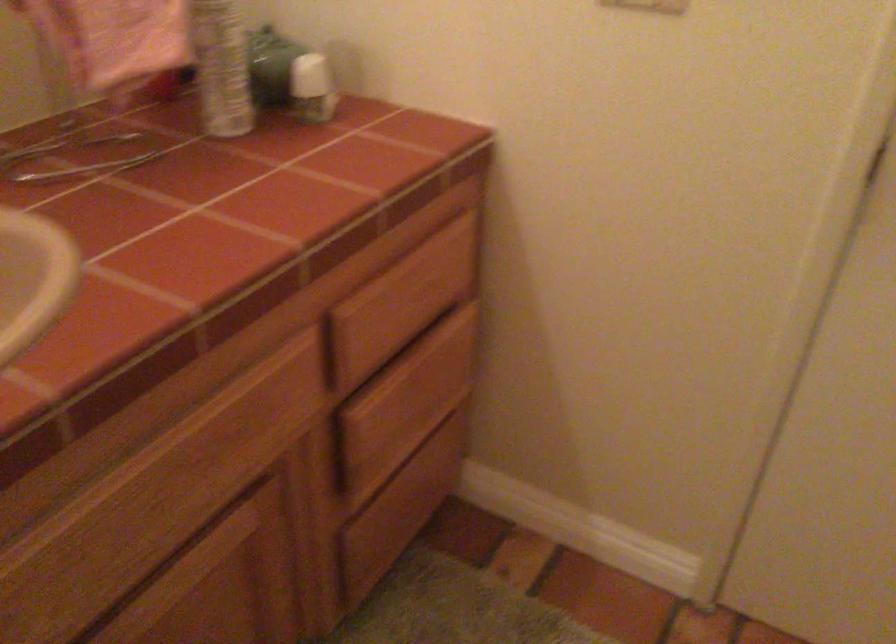
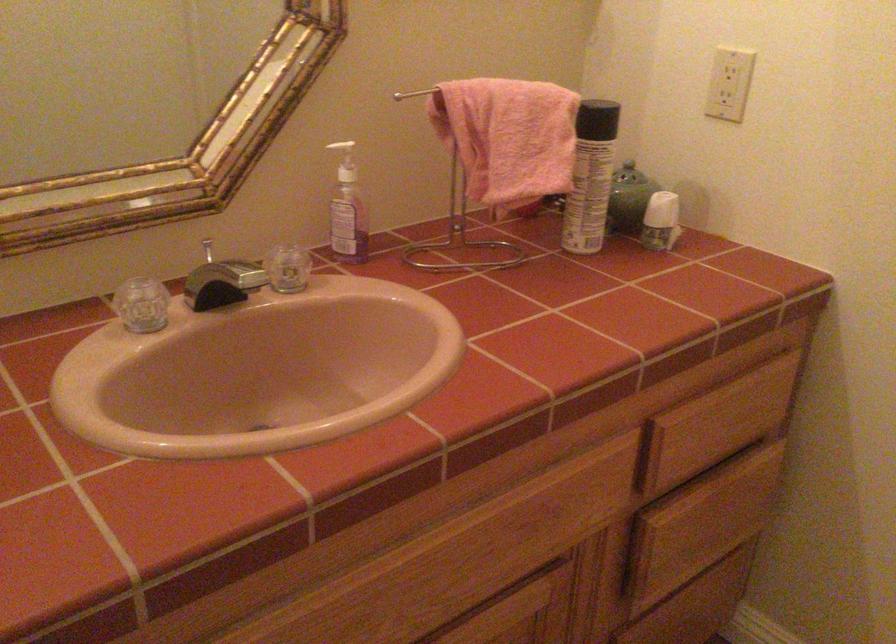
Where in the second image is the point corresponding to point 401,307 from the first image?

(718, 424)